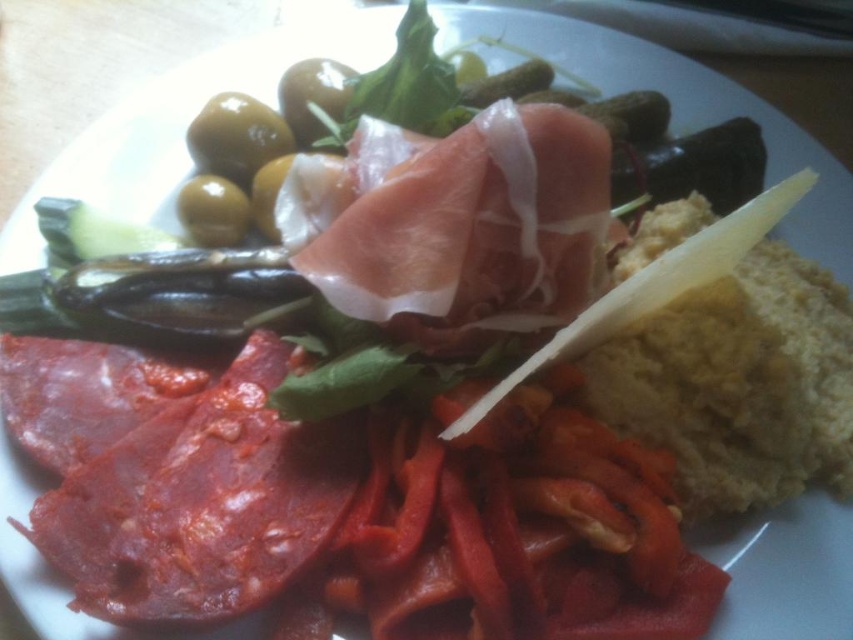
Is point (59, 392) positioned behind point (541, 145)?

Yes, point (59, 392) is farther from viewer.

Does red glossy salami at lower left have a larger size compared to pinkish-white cured meat at center?

Yes.

Where is `red glossy salami at lower left`? This screenshot has width=853, height=640. red glossy salami at lower left is located at coordinates (173, 476).